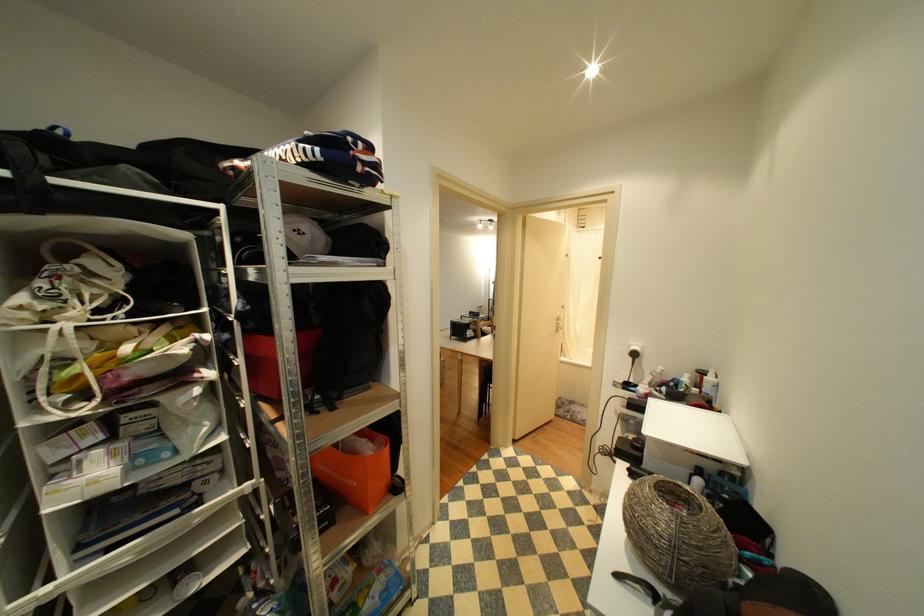
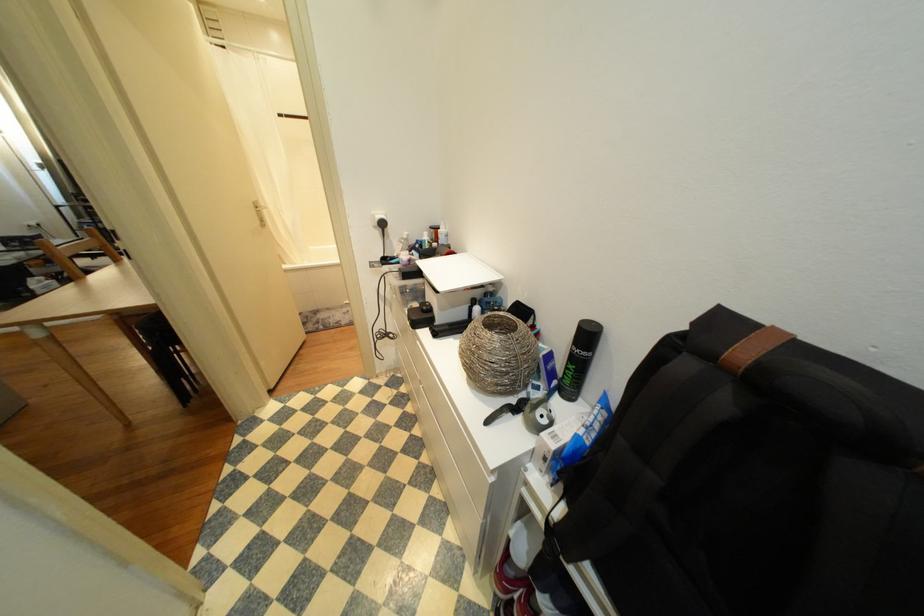
In the second image, find the point that corresponds to (638,344) in the first image.

(381, 214)